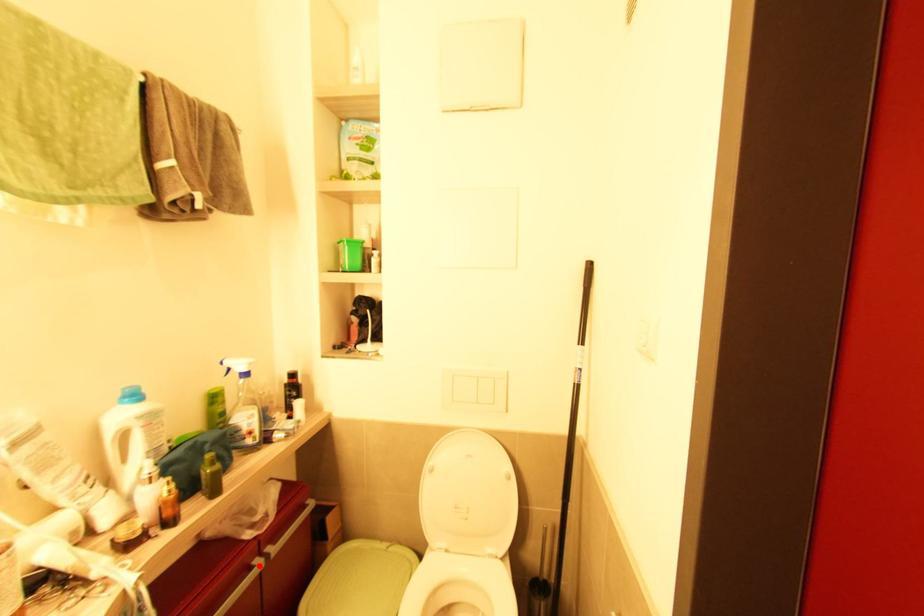
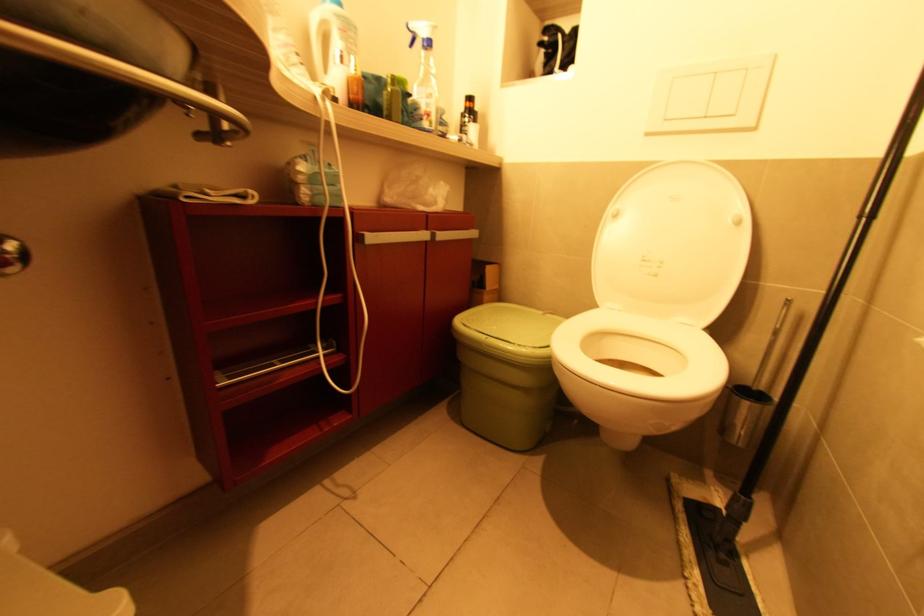
The point at the highlighted location is marked in the first image. Where is the corresponding point in the second image?

(426, 237)